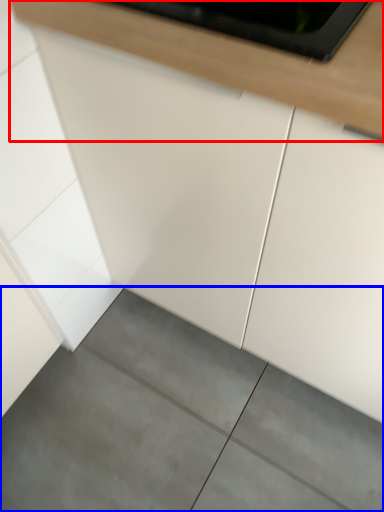
Question: Among these objects, which one is nearest to the camera, countertop (highlighted by a red box) or concrete (highlighted by a blue box)?

Choices:
 (A) countertop
 (B) concrete

Answer: (A)